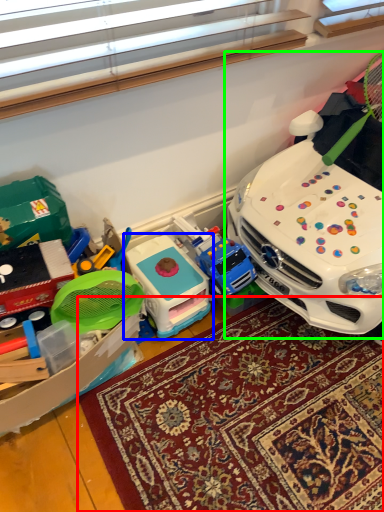
Question: Which object is the farthest from mat (highlighted by a red box)? Choose among these: toy (highlighted by a blue box) or toy (highlighted by a green box).

Choices:
 (A) toy
 (B) toy

Answer: (B)